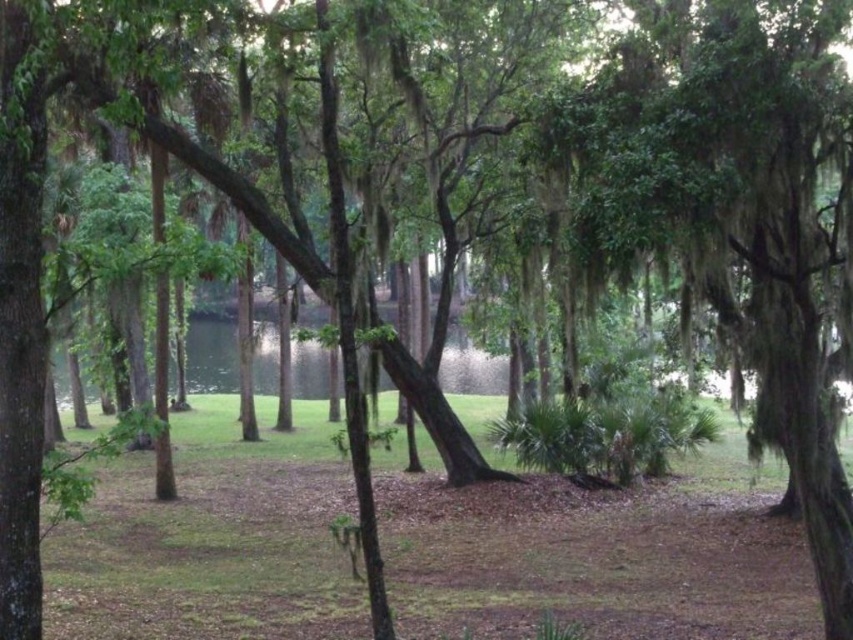
You are standing at the center of the forest scene. You want to place a small garden ornament exactly at the green grass at center. What are the coordinates where you should place it?

The coordinates for the green grass at center are point (596,556), so you should place the ornament there.

You are a hiker who wants to take a clear photo of the green mossy tree at center without any obstructions. Since you are standing on the green grass at center, can you easily capture the tree in your shot?

The green grass at center is larger in size than green mossy tree at center, so the grass might block the view of the tree, making it difficult to take a clear photo without obstructions.

You are a hiker navigating through the forest and want to reach the water in the background. You see the green grass at center and the green mossy tree at center. Which object is closer to you, and which is closer to the water?

The green grass at center is closer to you, while the green mossy tree at center is closer to the water because it is positioned behind the grass.